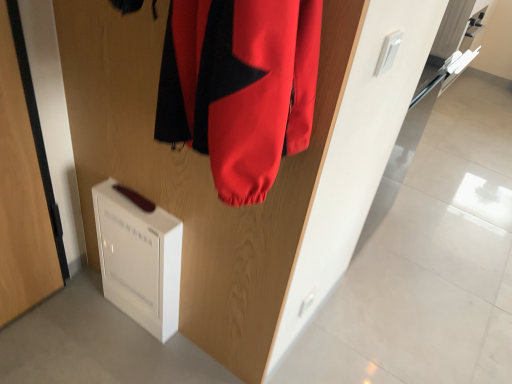
Where is `free space to the left of white plastic air purifier at lower left`? This screenshot has height=384, width=512. free space to the left of white plastic air purifier at lower left is located at coordinates (88, 302).